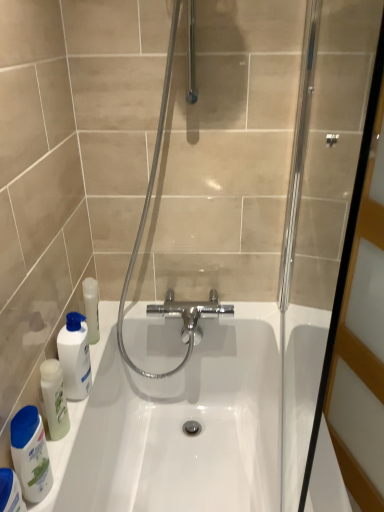
Question: Does clear glass screen door at right have a larger size compared to translucent plastic bottle at lower left, which appears as the first cleaning product when viewed from the front?

Choices:
 (A) no
 (B) yes

Answer: (B)

Question: Is the position of clear glass screen door at right more distant than that of translucent plastic bottle at lower left, which appears as the first cleaning product when viewed from the front?

Choices:
 (A) no
 (B) yes

Answer: (A)

Question: From the image's perspective, is clear glass screen door at right over translucent plastic bottle at lower left, the 3th cleaning product positioned from the back?

Choices:
 (A) no
 (B) yes

Answer: (B)

Question: From the image's perspective, is clear glass screen door at right under translucent plastic bottle at lower left, which appears as the first cleaning product when viewed from the front?

Choices:
 (A) yes
 (B) no

Answer: (B)

Question: Is clear glass screen door at right thinner than translucent plastic bottle at lower left, which appears as the first cleaning product when viewed from the front?

Choices:
 (A) yes
 (B) no

Answer: (A)

Question: Considering their positions, is white glossy bottle at lower left, positioned as the 2th cleaning product in front-to-back order, located in front of or behind white glossy mouthwash at left?

Choices:
 (A) front
 (B) behind

Answer: (A)

Question: Is point (9, 439) positioned closer to the camera than point (87, 387)?

Choices:
 (A) closer
 (B) farther

Answer: (A)

Question: In terms of size, does white glossy bottle at lower left, which is the second cleaning product in back-to-front order, appear bigger or smaller than white glossy mouthwash at left?

Choices:
 (A) small
 (B) big

Answer: (A)

Question: Is white glossy bottle at lower left, which is the second cleaning product in back-to-front order, inside the boundaries of white glossy mouthwash at left, or outside?

Choices:
 (A) inside
 (B) outside

Answer: (B)

Question: From a real-world perspective, is white glossy mouthwash at left physically located above or below white glossy bottle at lower left, positioned as the 2th cleaning product in front-to-back order?

Choices:
 (A) above
 (B) below

Answer: (A)

Question: In terms of width, does white glossy mouthwash at left look wider or thinner when compared to white glossy bottle at lower left, positioned as the 2th cleaning product in front-to-back order?

Choices:
 (A) wide
 (B) thin

Answer: (A)

Question: Is point (71, 321) positioned closer to the camera than point (21, 409)?

Choices:
 (A) closer
 (B) farther

Answer: (B)

Question: Would you say white glossy mouthwash at left is to the left or to the right of white glossy bottle at lower left, positioned as the 2th cleaning product in front-to-back order, in the picture?

Choices:
 (A) left
 (B) right

Answer: (B)

Question: Does point click(x=152, y=402) appear closer or farther from the camera than point click(x=13, y=501)?

Choices:
 (A) farther
 (B) closer

Answer: (A)

Question: Looking at their shapes, would you say white glossy bathtub at lower left is wider or thinner than translucent plastic bottle at lower left, which appears as the first cleaning product when viewed from the front?

Choices:
 (A) wide
 (B) thin

Answer: (A)